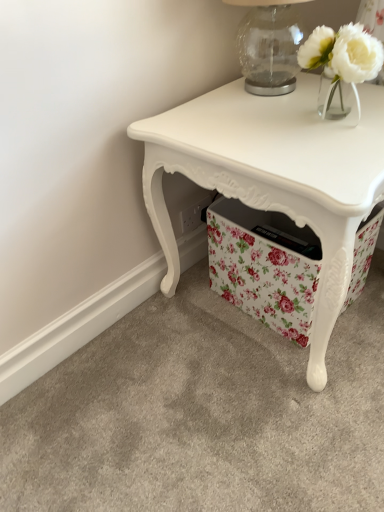
Question: Is white glossy table at center taller or shorter than transparent glass table lamp at upper right?

Choices:
 (A) tall
 (B) short

Answer: (A)

Question: From a real-world perspective, is white glossy table at center above or below transparent glass table lamp at upper right?

Choices:
 (A) above
 (B) below

Answer: (B)

Question: Which object is positioned farthest from the white glossy table at center?

Choices:
 (A) white glass vase at upper right
 (B) transparent glass table lamp at upper right
 (C) floral fabric storage box at lower center

Answer: (B)

Question: Estimate the real-world distances between objects in this image. Which object is closer to the white glass vase at upper right?

Choices:
 (A) white glossy table at center
 (B) floral fabric storage box at lower center
 (C) transparent glass table lamp at upper right

Answer: (C)